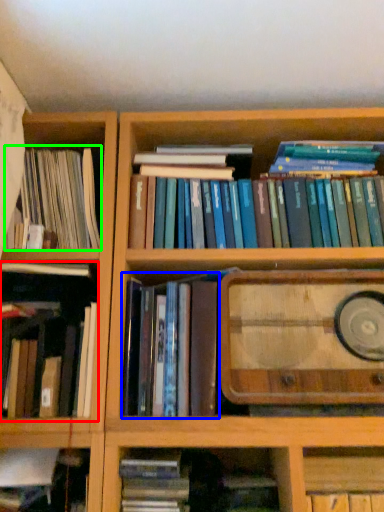
Question: Considering the real-world distances, which object is closest to book (highlighted by a red box)? book (highlighted by a blue box) or book (highlighted by a green box).

Choices:
 (A) book
 (B) book

Answer: (A)